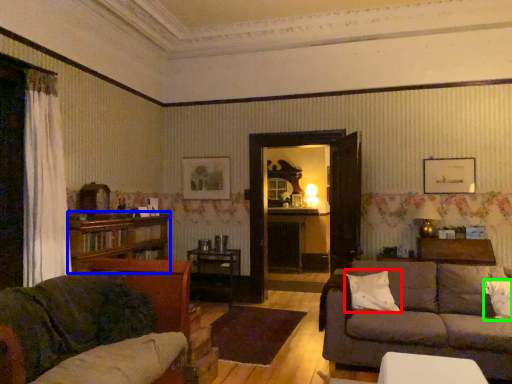
Question: Based on their relative distances, which object is farther from pillow (highlighted by a red box)? Choose from bookcase (highlighted by a blue box) and pillow (highlighted by a green box).

Choices:
 (A) bookcase
 (B) pillow

Answer: (A)